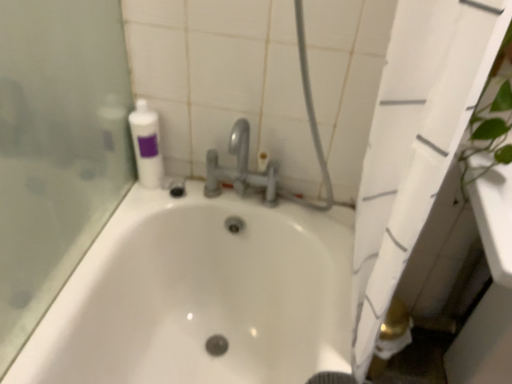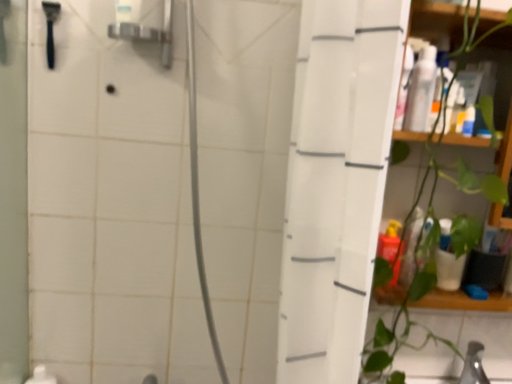
Question: How did the camera likely rotate when shooting the video?

Choices:
 (A) rotated left
 (B) rotated right

Answer: (B)